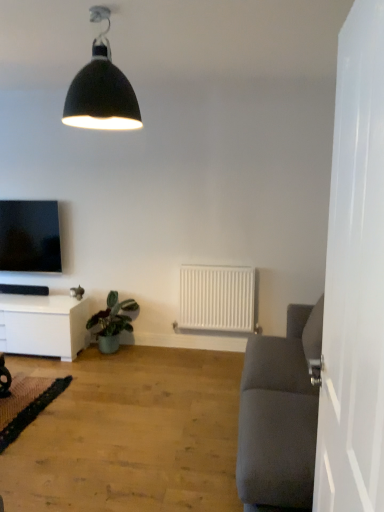
What do you see at coordinates (130, 434) in the screenshot? The width and height of the screenshot is (384, 512). I see `wooden floor at lower left` at bounding box center [130, 434].

What do you see at coordinates (43, 325) in the screenshot? This screenshot has width=384, height=512. I see `white glossy cabinet at lower left` at bounding box center [43, 325].

The height and width of the screenshot is (512, 384). I want to click on black matte lampshade at upper center, so click(x=101, y=89).

Where is `green matte plant at lower left`? The width and height of the screenshot is (384, 512). green matte plant at lower left is located at coordinates (112, 322).

From a real-world perspective, which object stands above the other?

white matte radiator at center, from a real-world perspective.

In terms of size, does green matte plant at lower left appear bigger or smaller than white matte radiator at center?

green matte plant at lower left is bigger than white matte radiator at center.

Is green matte plant at lower left inside or outside of white matte radiator at center?

green matte plant at lower left is located beyond the bounds of white matte radiator at center.

Between point (95, 314) and point (227, 304), which one is positioned in front?

Point (95, 314)

From a real-world perspective, is green matte plant at lower left under green textured mat at lower left?

No, from a real-world perspective, green matte plant at lower left is not beneath green textured mat at lower left.

Which object is closer to the camera taking this photo, green matte plant at lower left or green textured mat at lower left?

green textured mat at lower left is more forward.

How much distance is there between green matte plant at lower left and green textured mat at lower left?

A distance of 31.75 inches exists between green matte plant at lower left and green textured mat at lower left.

In the scene shown: How many degrees apart are the facing directions of green matte plant at lower left and green textured mat at lower left?

There is a 1-degree angle between the facing directions of green matte plant at lower left and green textured mat at lower left.

Between green textured mat at lower left and green matte plant at lower left, which one has less height?

green textured mat at lower left is shorter.

From the picture: Is green textured mat at lower left not inside green matte plant at lower left?

Indeed, green textured mat at lower left is completely outside green matte plant at lower left.

Which object is positioned more to the left, green textured mat at lower left or green matte plant at lower left?

From the viewer's perspective, green textured mat at lower left appears more on the left side.

In the scene shown: Is green textured mat at lower left turned away from green matte plant at lower left?

No, green textured mat at lower left is not facing the opposite direction of green matte plant at lower left.

Is point (183, 405) less distant than point (111, 303)?

Yes.

Where is `plain located on the left of green matte plant at lower left`? The width and height of the screenshot is (384, 512). plain located on the left of green matte plant at lower left is located at coordinates (130, 434).

From a real-world perspective, is wooden floor at lower left on top of green matte plant at lower left?

No, from a real-world perspective, wooden floor at lower left is not over green matte plant at lower left

From the image's perspective, relative to matte black tv at left, is white glossy door at right above or below?

Clearly, from the image's perspective, white glossy door at right is below matte black tv at left.

Between point (357, 420) and point (20, 244), which one is positioned behind?

Positioned behind is point (20, 244).

Which object is wider, white glossy door at right or matte black tv at left?

matte black tv at left.

Can we say white glossy cabinet at lower left lies outside black matte lampshade at upper center?

Indeed, white glossy cabinet at lower left is completely outside black matte lampshade at upper center.

From the picture: Does white glossy cabinet at lower left lie in front of black matte lampshade at upper center?

No, white glossy cabinet at lower left is behind black matte lampshade at upper center.

From the picture: In terms of size, does white glossy cabinet at lower left appear bigger or smaller than black matte lampshade at upper center?

In the image, white glossy cabinet at lower left appears to be larger than black matte lampshade at upper center.

Does white glossy cabinet at lower left have a lesser width compared to black matte lampshade at upper center?

Incorrect, the width of white glossy cabinet at lower left is not less than that of black matte lampshade at upper center.

Is matte black tv at left completely or partially outside of white glossy cabinet at lower left?

Yes, matte black tv at left is located beyond the bounds of white glossy cabinet at lower left.

Considering the positions of objects matte black tv at left and white glossy cabinet at lower left in the image provided, who is more to the right, matte black tv at left or white glossy cabinet at lower left?

Positioned to the right is white glossy cabinet at lower left.

Is matte black tv at left not close to white glossy cabinet at lower left?

They are positioned close to each other.

From the image's perspective, is matte black tv at left beneath white glossy cabinet at lower left?

No.

The width and height of the screenshot is (384, 512). I want to click on radiator located above the green matte plant at lower left (from the image's perspective), so click(216, 298).

The height and width of the screenshot is (512, 384). I want to click on mat lying in front of the green matte plant at lower left, so click(x=26, y=404).

Looking at this image, from the image, which object appears to be nearer to matte black tv at left, green textured mat at lower left or green matte plant at lower left?

green matte plant at lower left.

From the image, which object appears to be farther from green matte plant at lower left, green textured mat at lower left or white glossy cabinet at lower left?

Among the two, green textured mat at lower left is located further to green matte plant at lower left.

Which object lies further to the anchor point green matte plant at lower left, white matte radiator at center or wooden floor at lower left?

wooden floor at lower left is further to green matte plant at lower left.

Consider the image. Which object lies further to the anchor point matte black tv at left, white glossy cabinet at lower left or white glossy door at right?

Based on the image, white glossy door at right appears to be further to matte black tv at left.

Estimate the real-world distances between objects in this image. Which object is further from white glossy cabinet at lower left, matte black tv at left or white glossy door at right?

white glossy door at right is positioned further to the anchor white glossy cabinet at lower left.

Looking at the image, which one is located further to white glossy door at right, green textured mat at lower left or white matte radiator at center?

white matte radiator at center lies further to white glossy door at right than the other object.

Estimate the real-world distances between objects in this image. Which object is further from white glossy door at right, green textured mat at lower left or black matte lampshade at upper center?

green textured mat at lower left is further to white glossy door at right.

Considering their positions, is green textured mat at lower left positioned further to wooden floor at lower left than green matte plant at lower left?

green matte plant at lower left.

At what (x,y) coordinates should I click in order to perform the action: click on houseplant between green textured mat at lower left and white matte radiator at center from left to right. Please return your answer as a coordinate pair (x, y). The height and width of the screenshot is (512, 384). Looking at the image, I should click on (112, 322).

Where is `houseplant between matte black tv at left and white matte radiator at center from left to right`? houseplant between matte black tv at left and white matte radiator at center from left to right is located at coordinates (112, 322).

Where is `mat between wooden floor at lower left and white glossy cabinet at lower left from front to back`? Image resolution: width=384 pixels, height=512 pixels. mat between wooden floor at lower left and white glossy cabinet at lower left from front to back is located at coordinates (26, 404).

Find the location of `table between white glossy door at right and matte black tv at left in the front-back direction`. table between white glossy door at right and matte black tv at left in the front-back direction is located at coordinates tap(43, 325).